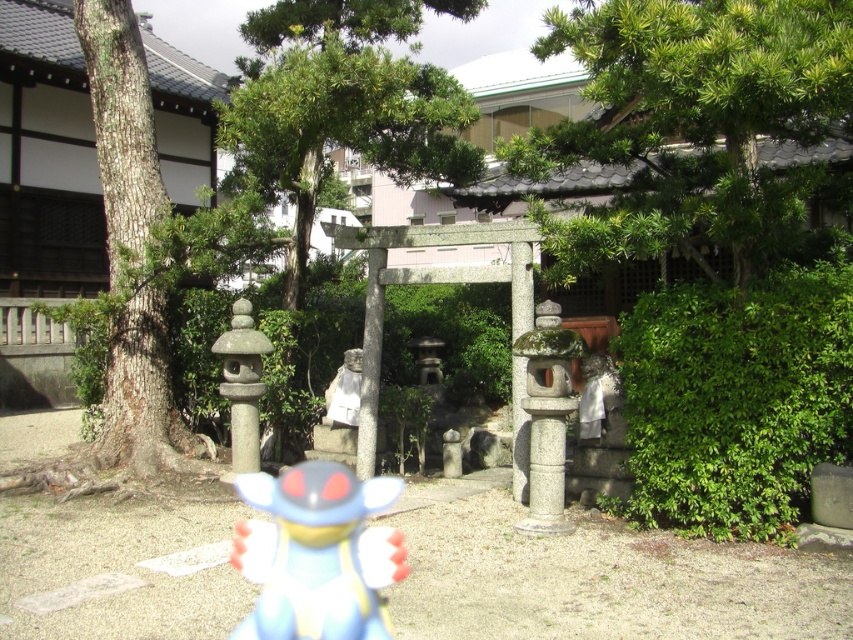
Between point (28, 77) and point (380, 636), which one is positioned in front?

Positioned in front is point (380, 636).

Which of these two, brown rough bark tree at left or shiny plastic toy at center, stands shorter?

With less height is shiny plastic toy at center.

Who is more distant from viewer, (65, 355) or (373, 540)?

The point (65, 355) is behind.

Identify the location of brown rough bark tree at left. (47, 157).

Does point (683, 209) come closer to viewer compared to point (454, 435)?

Yes.

Who is positioned more to the right, green leafy tree at upper center or matte stone statue at center?

Positioned to the right is green leafy tree at upper center.

Who is more forward, (677,97) or (444,465)?

Point (677,97)

Where is `green leafy tree at upper center`? This screenshot has height=640, width=853. green leafy tree at upper center is located at coordinates (694, 125).

Does brown rough bark tree at left appear on the right side of matte stone statue at center?

No, brown rough bark tree at left is not to the right of matte stone statue at center.

Between point (91, 200) and point (457, 433), which one is positioned behind?

Point (91, 200)

Find the location of a particular element. This screenshot has height=640, width=853. brown rough bark tree at left is located at coordinates (47, 157).